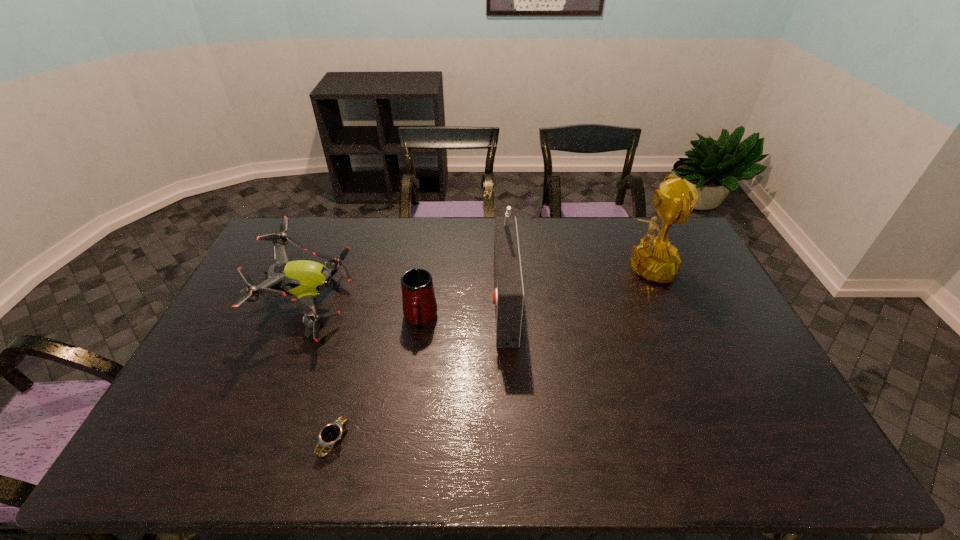
I want to click on free space in the image that satisfies the following two spatial constraints: 1. on the front side of the award; 2. on the side of the third object from right to left with the handle, so click(666, 319).

The width and height of the screenshot is (960, 540). Find the location of `vacant space that satisfies the following two spatial constraints: 1. on the front panel of the radio receiver; 2. on the front side of the fourth object from right to left`. vacant space that satisfies the following two spatial constraints: 1. on the front panel of the radio receiver; 2. on the front side of the fourth object from right to left is located at coordinates (511, 441).